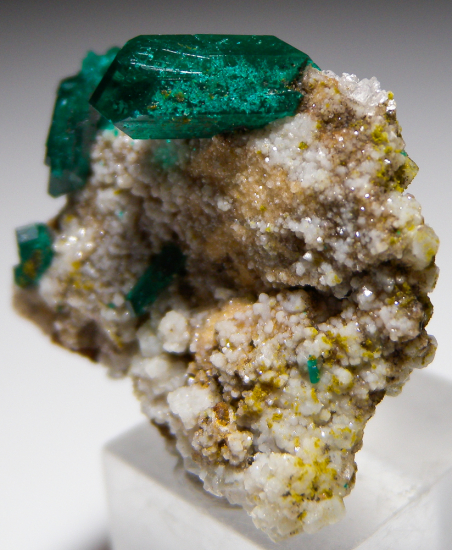
Find the location of a particular element. wall is located at coordinates (33, 145), (417, 139).